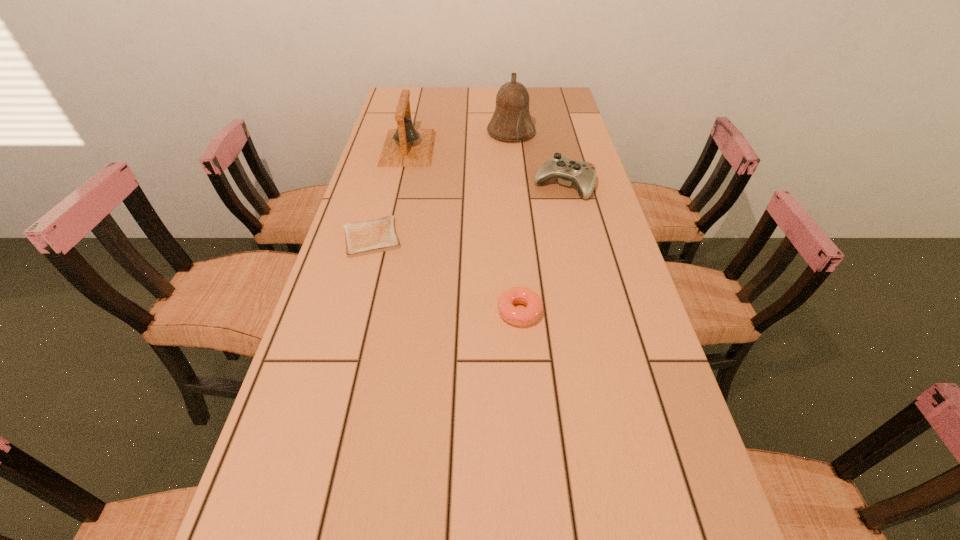
The height and width of the screenshot is (540, 960). I want to click on vacant space situated 0.210m on the front of the taller bell, so click(516, 178).

Where is `blank area located on the front of the left bell`? blank area located on the front of the left bell is located at coordinates (389, 231).

Find the location of `free space located on the left of the third farthest object`. free space located on the left of the third farthest object is located at coordinates (474, 186).

Where is `vacant area located 0.230m on the right of the doughnut`? The width and height of the screenshot is (960, 540). vacant area located 0.230m on the right of the doughnut is located at coordinates pyautogui.click(x=644, y=312).

Locate an element on the screen. The width and height of the screenshot is (960, 540). vacant space located 0.120m on the right of the second nearest object is located at coordinates (447, 238).

You are a GUI agent. You are given a task and a screenshot of the screen. Output one action in this format:
    pyautogui.click(x=<x>, y=<y>)
    Task: Click on the bell that is at the left edge
    
    Given the screenshot: What is the action you would take?
    pyautogui.click(x=405, y=146)

In order to click on toast at the left edge in this screenshot , I will do (363, 238).

Find the location of a particular element. This screenshot has height=540, width=960. object located in the right edge section of the desktop is located at coordinates (583, 174).

Image resolution: width=960 pixels, height=540 pixels. In order to click on vacant area at the far edge in this screenshot , I will do `click(477, 102)`.

Locate an element on the screen. This screenshot has height=540, width=960. vacant space at the left edge is located at coordinates (361, 181).